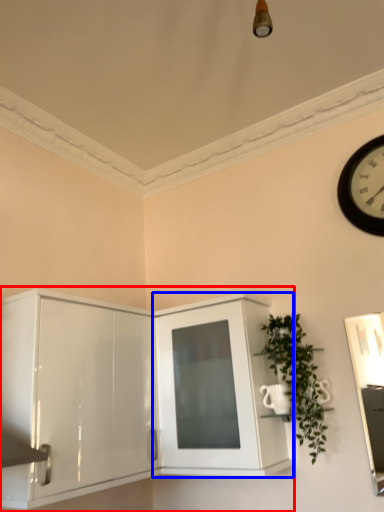
Question: Which object is further to the camera taking this photo, cabinetry (highlighted by a red box) or cabinetry (highlighted by a blue box)?

Choices:
 (A) cabinetry
 (B) cabinetry

Answer: (B)